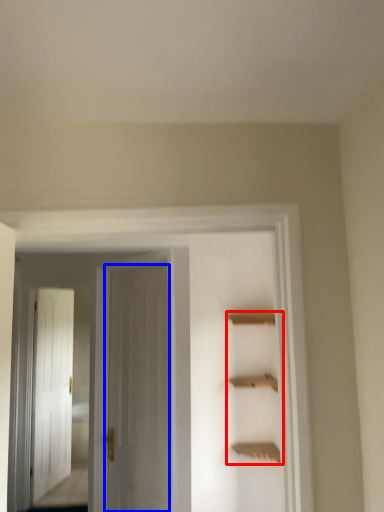
Question: Which of the following is the closest to the observer, cabinet (highlighted by a red box) or door (highlighted by a blue box)?

Choices:
 (A) cabinet
 (B) door

Answer: (A)